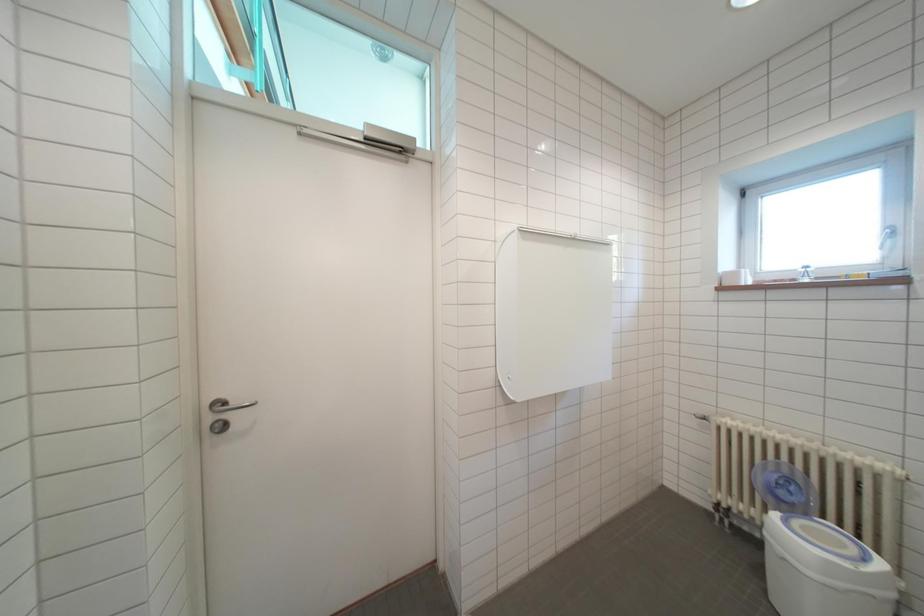
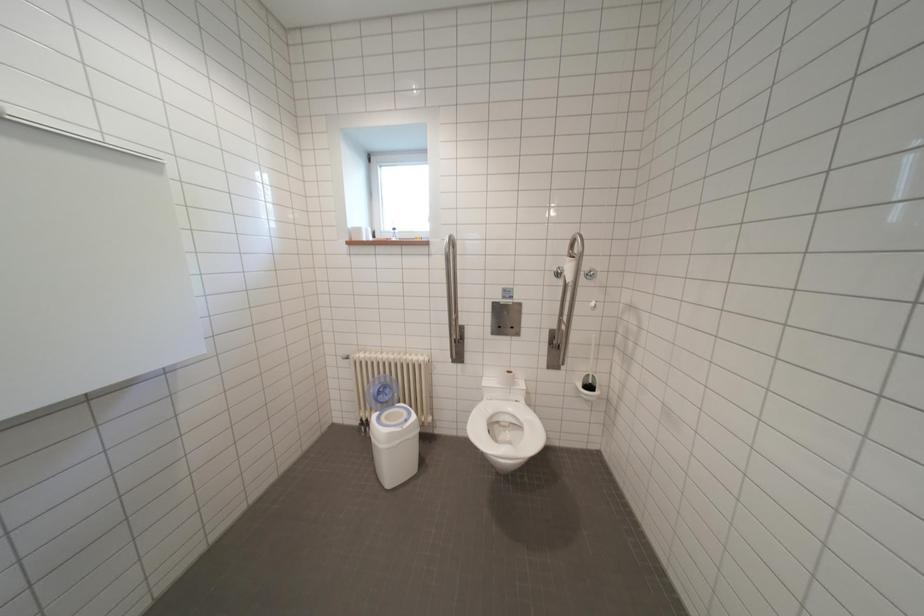
Question: The camera is either moving clockwise (left) or counter-clockwise (right) around the object. The first image is from the beginning of the video and the second image is from the end. Is the camera moving left or right when shooting the video?

Choices:
 (A) Left
 (B) Right

Answer: (A)